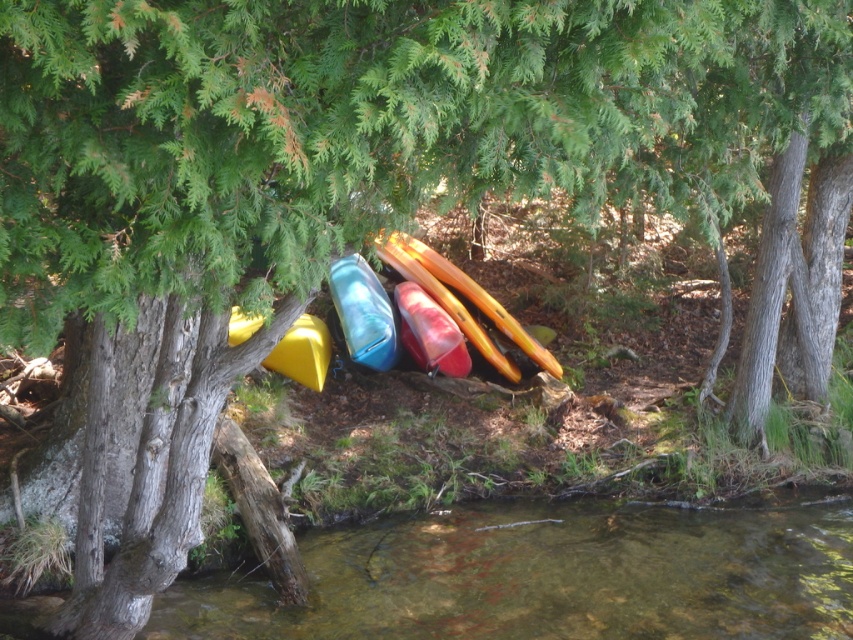
You are standing at the edge of the water and see the yellow matte kayak at center and the clear water at lower center. Which object is closer to your right side?

The clear water at lower center is to the right of the yellow matte kayak at center, so it is closer to your right side.

You are standing in the scene and want to place a small flag at the closest point between point (x=300, y=332) and point (x=381, y=259). Which point should you choose?

Point (x=300, y=332) is closer to the viewer than point (x=381, y=259), so you should place the flag at point (x=300, y=332).